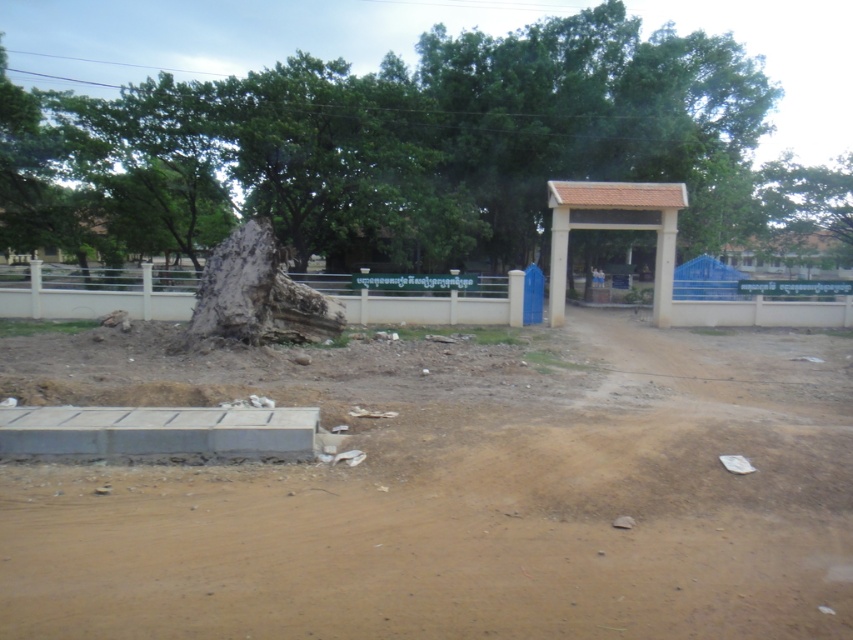
Which is behind, point (723, 513) or point (227, 314)?

The point (227, 314) is behind.

Looking at this image, is brown sandy dirt at lower left smaller than rough bark stump at center?

No.

Image resolution: width=853 pixels, height=640 pixels. What do you see at coordinates (451, 492) in the screenshot? I see `brown sandy dirt at lower left` at bounding box center [451, 492].

Where is `brown sandy dirt at lower left`? brown sandy dirt at lower left is located at coordinates (451, 492).

The image size is (853, 640). Describe the element at coordinates (418, 148) in the screenshot. I see `green leafy tree at center` at that location.

Is green leafy tree at center thinner than rough bark stump at center?

No, green leafy tree at center is not thinner than rough bark stump at center.

At what (x,y) coordinates should I click in order to perform the action: click on green leafy tree at center. Please return your answer as a coordinate pair (x, y). The image size is (853, 640). Looking at the image, I should click on (418, 148).

Where is `green leafy tree at center`? green leafy tree at center is located at coordinates 418,148.

Looking at this image, can you confirm if brown sandy dirt at lower left is positioned above green leafy tree at center?

Incorrect, brown sandy dirt at lower left is not positioned above green leafy tree at center.

Is point (451, 468) positioned before point (202, 205)?

Yes.

Is point (112, 358) more distant than point (489, 93)?

No, it is in front of (489, 93).

At what (x,y) coordinates should I click in order to perform the action: click on brown sandy dirt at lower left. Please return your answer as a coordinate pair (x, y). Looking at the image, I should click on (451, 492).